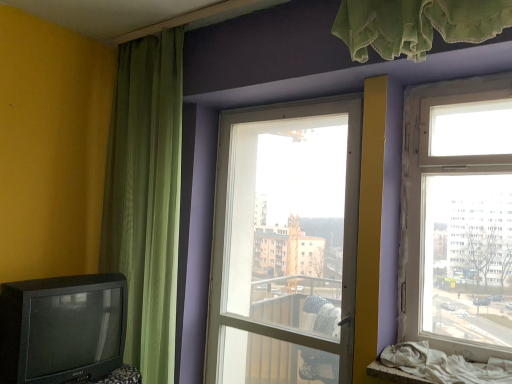
Question: Would you say matte black television at lower left is inside or outside transparent glass door at center, which is the second window from front to back?

Choices:
 (A) outside
 (B) inside

Answer: (A)

Question: From a real-world perspective, is matte black television at lower left above or below transparent glass door at center, the first window viewed from the left?

Choices:
 (A) above
 (B) below

Answer: (B)

Question: Which object is positioned closest to the green sheer curtain at left?

Choices:
 (A) transparent glass door at center, placed as the second window when sorted from right to left
 (B) clear glass window at upper right, which is counted as the first window, starting from the front
 (C) matte black television at lower left

Answer: (C)

Question: Based on their relative distances, which object is farther from the matte black television at lower left?

Choices:
 (A) transparent glass door at center, the first window viewed from the left
 (B) clear glass window at upper right, the first window from the right
 (C) green sheer curtain at left

Answer: (B)